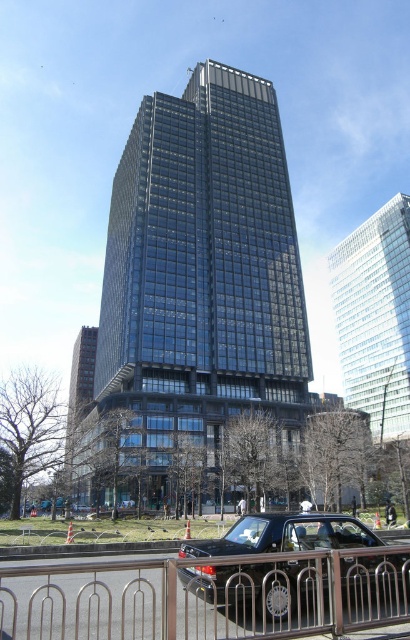
You are standing at the entrance of the skyscraper and want to reach the black car parked nearby. Which direction should you walk relative to the stainless steel fence at lower center to reach the car?

The stainless steel fence at lower center is located at point (205, 596), so you should walk towards the lower center direction to reach the black car parked near the fence.

You are standing in the modern urban landscape and want to locate the point at coordinates [205,596]. According to the image, where exactly is this point located?

The point at coordinates [205,596] is located on the stainless steel fence at lower center.

You are standing at the base of the clear glass skyscraper at upper center and want to walk to the stainless steel fence at lower center. In which direction should you move relative to the skyscraper?

You should move to the left relative to the clear glass skyscraper at upper center because the stainless steel fence at lower center is located to its left.